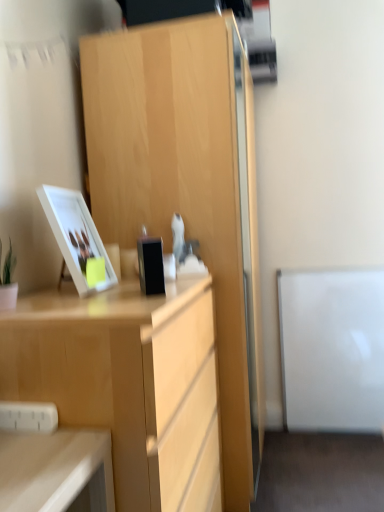
This screenshot has width=384, height=512. I want to click on vacant space situated on the left part of black glossy phone at center, so click(x=111, y=291).